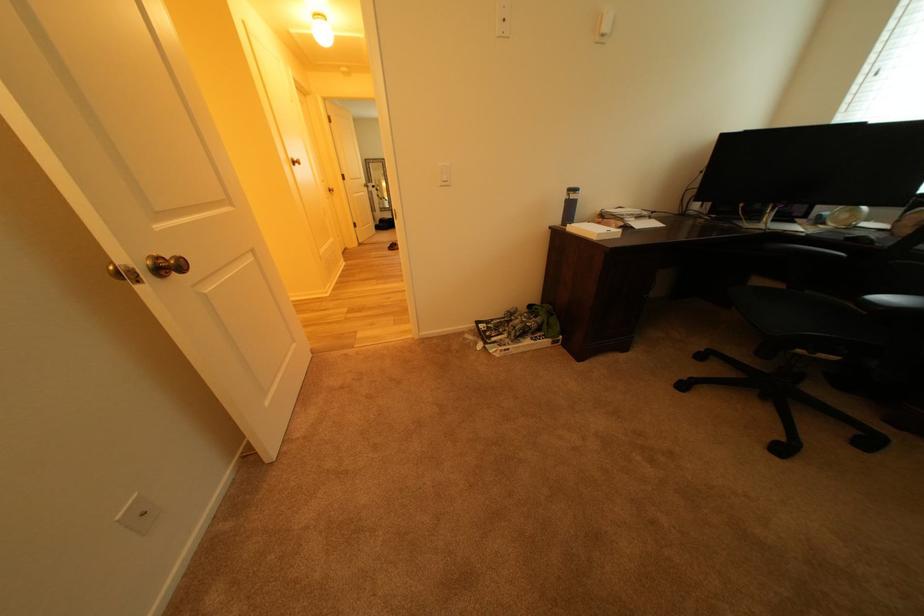
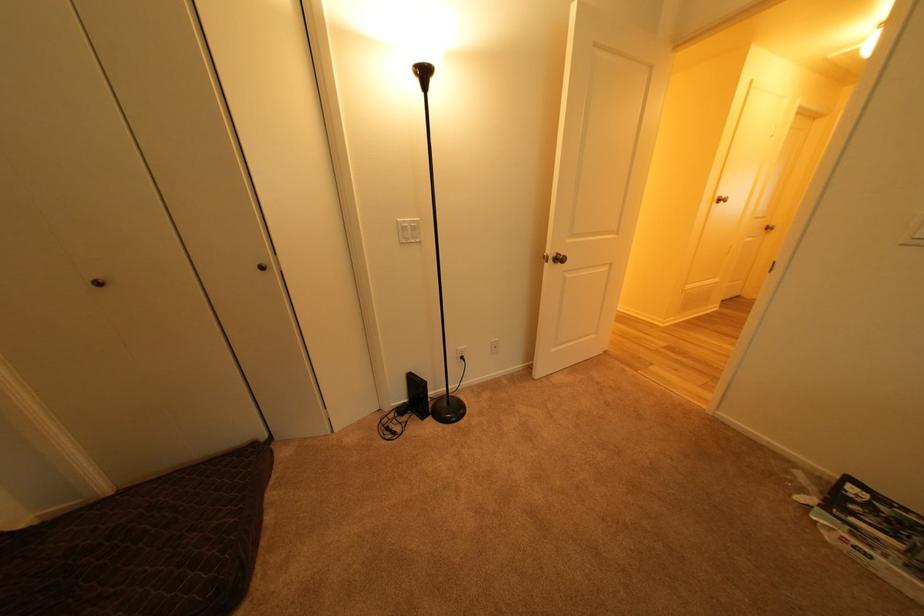
The point at [149,283] is marked in the first image. Where is the corresponding point in the second image?

(557, 264)